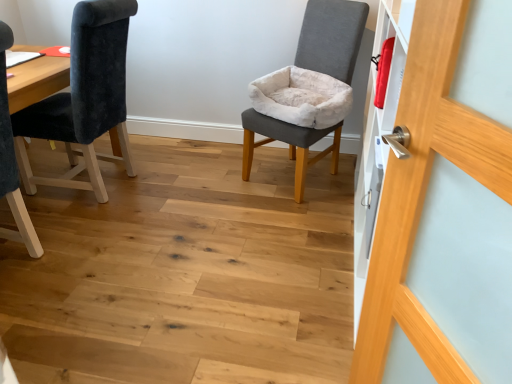
Question: Is wooden door handle at right turned away from velvet dark blue chair at left, the 2th chair viewed from the right?

Choices:
 (A) yes
 (B) no

Answer: (B)

Question: From the image's perspective, does wooden door handle at right appear lower than velvet dark blue chair at left, which is the 1th chair in left-to-right order?

Choices:
 (A) yes
 (B) no

Answer: (A)

Question: Does wooden door handle at right have a greater width compared to velvet dark blue chair at left, the 2th chair viewed from the right?

Choices:
 (A) yes
 (B) no

Answer: (B)

Question: From a real-world perspective, is wooden door handle at right positioned over velvet dark blue chair at left, the 2th chair viewed from the right, based on gravity?

Choices:
 (A) yes
 (B) no

Answer: (A)

Question: Is wooden door handle at right positioned far away from velvet dark blue chair at left, which is the 1th chair in left-to-right order?

Choices:
 (A) yes
 (B) no

Answer: (A)

Question: Considering their positions, is wooden door handle at right located in front of or behind gray fabric chair at center, the 1th chair viewed from the right?

Choices:
 (A) front
 (B) behind

Answer: (A)

Question: From a real-world perspective, is wooden door handle at right above or below gray fabric chair at center, placed as the 2th chair when sorted from left to right?

Choices:
 (A) below
 (B) above

Answer: (B)

Question: Is wooden door handle at right taller or shorter than gray fabric chair at center, placed as the 2th chair when sorted from left to right?

Choices:
 (A) short
 (B) tall

Answer: (B)

Question: Is wooden door handle at right to the left or to the right of gray fabric chair at center, the 1th chair viewed from the right, in the image?

Choices:
 (A) right
 (B) left

Answer: (A)

Question: Looking at their shapes, would you say velvet dark blue chair at left, the 2th chair viewed from the right, is wider or thinner than gray fabric chair at center, the 1th chair viewed from the right?

Choices:
 (A) wide
 (B) thin

Answer: (A)

Question: Is velvet dark blue chair at left, the 2th chair viewed from the right, taller or shorter than gray fabric chair at center, placed as the 2th chair when sorted from left to right?

Choices:
 (A) tall
 (B) short

Answer: (A)

Question: Is point (110, 107) positioned closer to the camera than point (309, 8)?

Choices:
 (A) farther
 (B) closer

Answer: (B)

Question: Is velvet dark blue chair at left, the 2th chair viewed from the right, in front of or behind gray fabric chair at center, the 1th chair viewed from the right, in the image?

Choices:
 (A) front
 (B) behind

Answer: (A)

Question: In terms of height, does velvet dark blue chair at left, which is the 1th chair in left-to-right order, look taller or shorter compared to wooden door handle at right?

Choices:
 (A) tall
 (B) short

Answer: (B)

Question: In the image, is velvet dark blue chair at left, the 2th chair viewed from the right, positioned in front of or behind wooden door handle at right?

Choices:
 (A) front
 (B) behind

Answer: (B)